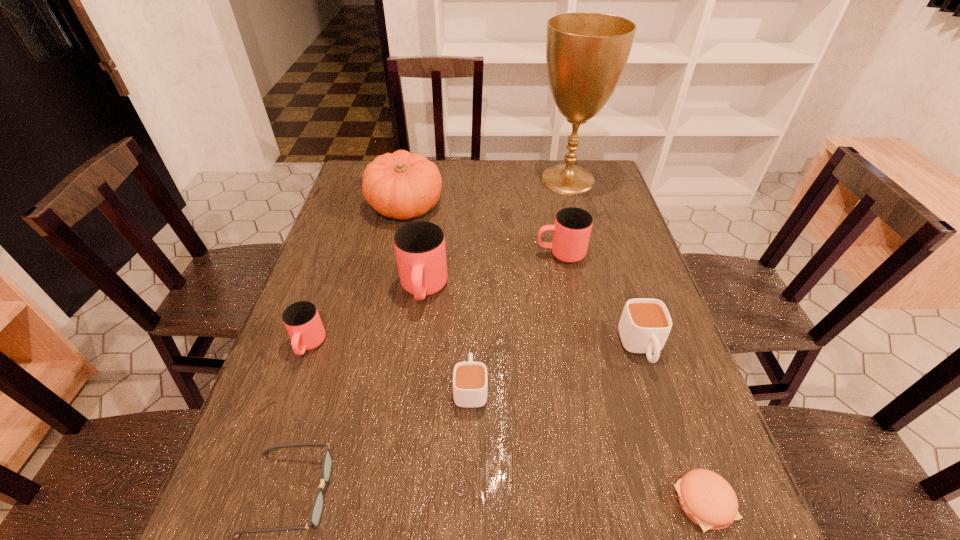
The height and width of the screenshot is (540, 960). I want to click on patty that is positioned at the near edge, so click(x=706, y=498).

Locate an element on the screen. The image size is (960, 540). pumpkin that is at the left edge is located at coordinates [401, 185].

You are a GUI agent. You are given a task and a screenshot of the screen. Output one action in this format:
    pyautogui.click(x=<x>, y=<y>)
    Task: Click on the cup located in the left edge section of the desktop
    Image resolution: width=960 pixels, height=540 pixels.
    Given the screenshot: What is the action you would take?
    pyautogui.click(x=301, y=319)

I want to click on spectacles that is at the left edge, so click(317, 507).

At what (x,y) coordinates should I click in order to perform the action: click on trophy cup located at the right edge. Please return your answer as a coordinate pair (x, y). This screenshot has height=540, width=960. Looking at the image, I should click on (586, 52).

Locate an element on the screen. patty that is at the right edge is located at coordinates (706, 498).

Locate an element on the screen. The image size is (960, 540). object at the far left corner is located at coordinates (401, 185).

The height and width of the screenshot is (540, 960). What are the coordinates of `object present at the near left corner` in the screenshot? It's located at (317, 507).

In order to click on object positioned at the far right corner in this screenshot , I will do `click(586, 52)`.

You are a GUI agent. You are given a task and a screenshot of the screen. Output one action in this format:
    pyautogui.click(x=<x>, y=<y>)
    Task: Click on the object positioned at the near right corner
    
    Given the screenshot: What is the action you would take?
    pyautogui.click(x=706, y=498)